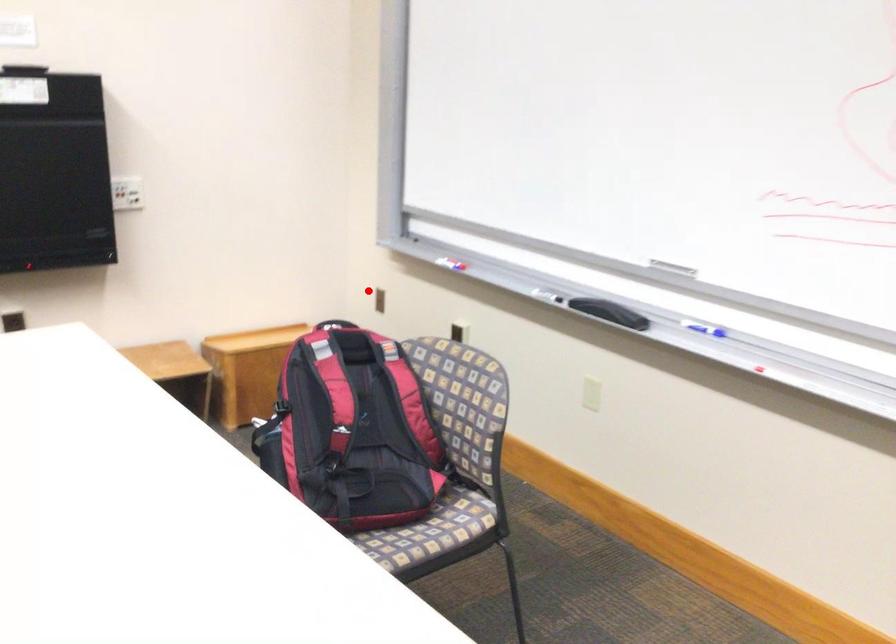
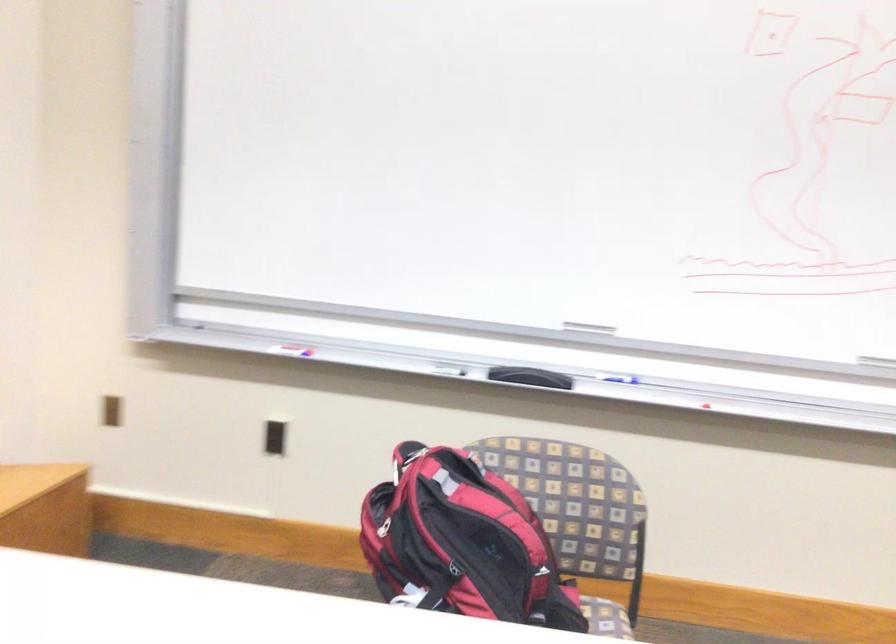
Question: A red point is marked in image1. In image2, is the corresponding 3D point closer to the camera or farther? Reply with the corresponding letter.

Choices:
 (A) The corresponding 3D point is closer.
 (B) The corresponding 3D point is farther.

Answer: (A)